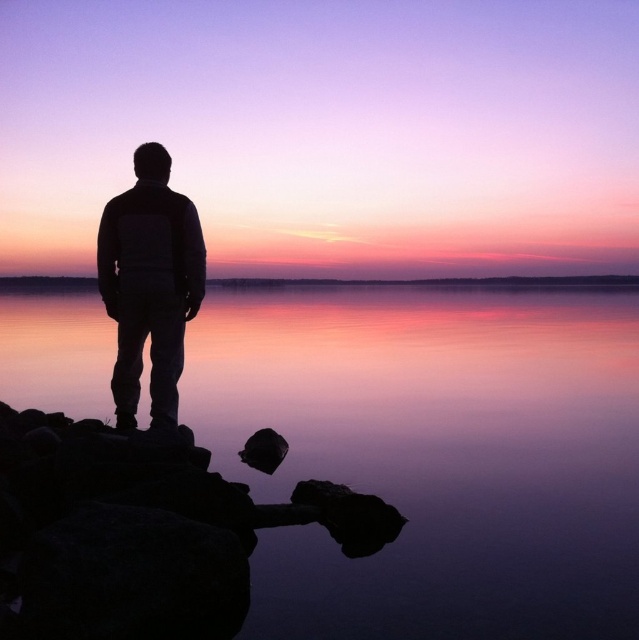
Between smooth water at center and silhouette jacket at center, which one has less height?

silhouette jacket at center is shorter.

Can you confirm if smooth water at center is smaller than silhouette jacket at center?

No.

I want to click on smooth water at center, so click(435, 454).

This screenshot has width=639, height=640. I want to click on smooth water at center, so click(x=435, y=454).